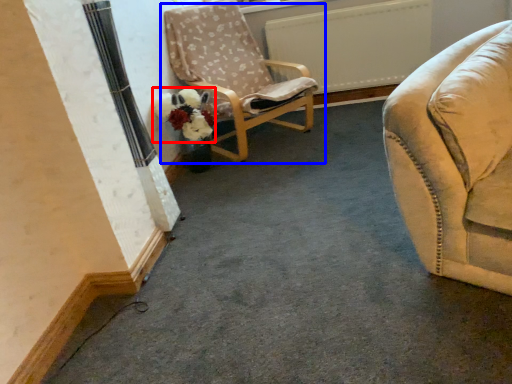
Question: Which of the following is the farthest to the observer, flower (highlighted by a red box) or chair (highlighted by a blue box)?

Choices:
 (A) flower
 (B) chair

Answer: (A)